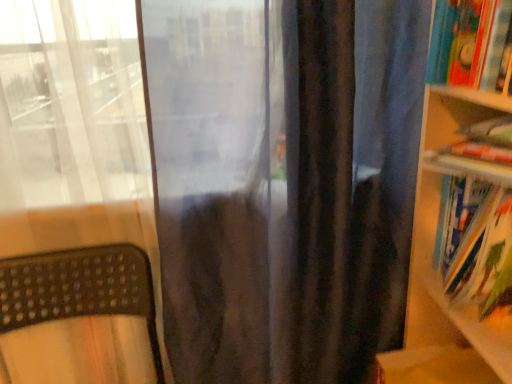
Question: Is hardcover book at right, arranged as the first book when ordered from the bottom, located outside hardcover books at right?

Choices:
 (A) yes
 (B) no

Answer: (B)

Question: Is hardcover book at right, arranged as the first book when ordered from the bottom, not close to hardcover books at right?

Choices:
 (A) no
 (B) yes

Answer: (A)

Question: Is hardcover book at right, which ranks as the 2th book in top-to-bottom order, facing away from hardcover books at right?

Choices:
 (A) yes
 (B) no

Answer: (A)

Question: Is hardcover book at right, arranged as the first book when ordered from the bottom, placed right next to hardcover books at right?

Choices:
 (A) no
 (B) yes

Answer: (B)

Question: From a real-world perspective, is hardcover book at right, which ranks as the 2th book in top-to-bottom order, below hardcover books at right?

Choices:
 (A) no
 (B) yes

Answer: (B)

Question: From the image's perspective, is hardcover books at right above or below hardcover book at right, arranged as the first book when ordered from the bottom?

Choices:
 (A) above
 (B) below

Answer: (A)

Question: Is hardcover books at right wider or thinner than hardcover book at right, which ranks as the 2th book in top-to-bottom order?

Choices:
 (A) thin
 (B) wide

Answer: (B)

Question: From their relative heights in the image, would you say hardcover books at right is taller or shorter than hardcover book at right, arranged as the first book when ordered from the bottom?

Choices:
 (A) short
 (B) tall

Answer: (B)

Question: Is hardcover books at right in front of or behind hardcover book at right, which ranks as the 2th book in top-to-bottom order, in the image?

Choices:
 (A) behind
 (B) front

Answer: (B)

Question: Does point (123, 286) appear closer or farther from the camera than point (437, 231)?

Choices:
 (A) farther
 (B) closer

Answer: (A)

Question: Considering the positions of brown textured mat at lower left and hardcover book at right, which ranks as the 2th book in top-to-bottom order, in the image, is brown textured mat at lower left wider or thinner than hardcover book at right, which ranks as the 2th book in top-to-bottom order,?

Choices:
 (A) wide
 (B) thin

Answer: (A)

Question: Would you say brown textured mat at lower left is to the left or to the right of hardcover book at right, arranged as the first book when ordered from the bottom, in the picture?

Choices:
 (A) right
 (B) left

Answer: (B)

Question: From a real-world perspective, is brown textured mat at lower left physically located above or below hardcover book at right, which ranks as the 2th book in top-to-bottom order?

Choices:
 (A) below
 (B) above

Answer: (A)

Question: Visually, is hardcover book at right, arranged as the first book when ordered from the bottom, positioned to the left or to the right of hardcover books at right?

Choices:
 (A) right
 (B) left

Answer: (B)

Question: From the image's perspective, is hardcover book at right, which ranks as the 2th book in top-to-bottom order, positioned above or below hardcover books at right?

Choices:
 (A) below
 (B) above

Answer: (A)